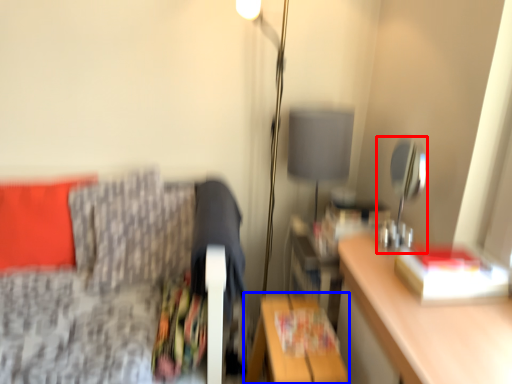
Question: Which object is further to the camera taking this photo, table lamp (highlighted by a red box) or table (highlighted by a blue box)?

Choices:
 (A) table lamp
 (B) table

Answer: (A)